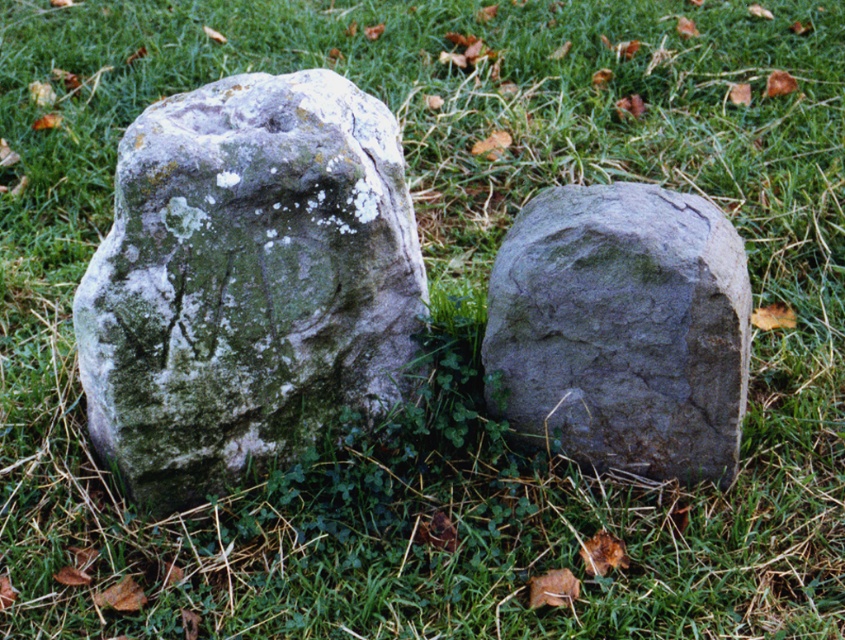
You are standing at the origin point of the coordinate system where the grassy surface starts. You want to place a new decorative stone exactly at the point marked as point (246, 280). However, there is already a speckled gray stone at center located there. What should you do?

The speckled gray stone at center is already located at point (246, 280), so you cannot place the new decorative stone there without moving the existing one.

You are standing in a field and see the speckled gray stone at center. If you want to place a 2 meter long ladder on the ground between you and the stone, will it fit without overlapping the stone?

The distance between you and the speckled gray stone at center is 1.95 meters. Since the ladder is 2 meters long, it will not fit entirely between you and the stone without overlapping the stone.

Based on the photo, you are trying to place a small garden ornament between the speckled gray stone at center and the gray rough stone at center. Based on their widths, which stone should you position the ornament closer to?

The speckled gray stone at center might be wider than the gray rough stone at center, so you should position the ornament closer to the gray rough stone at center to ensure there is enough space.